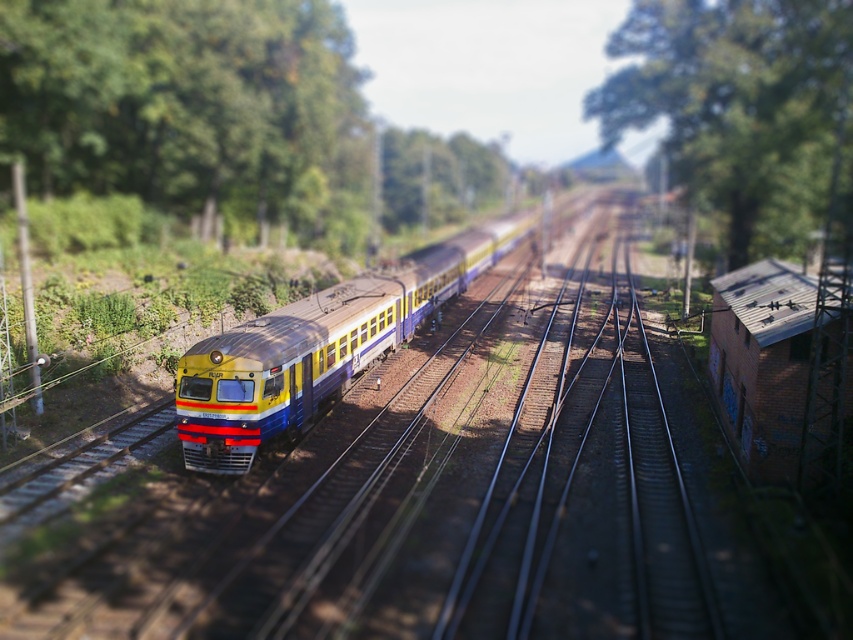
Question: Which is farther from the yellow matte train at center?

Choices:
 (A) green leafy tree at upper center
 (B) green leafy tree at upper left

Answer: (B)

Question: From the image, what is the correct spatial relationship of green leafy tree at upper left in relation to green leafy tree at upper center?

Choices:
 (A) above
 (B) below

Answer: (B)

Question: Which of these objects is positioned farthest from the yellow matte train at center?

Choices:
 (A) green leafy tree at upper center
 (B) green leafy tree at upper left

Answer: (B)

Question: Is green leafy tree at upper left positioned before green leafy tree at upper center?

Choices:
 (A) yes
 (B) no

Answer: (B)

Question: Is green leafy tree at upper left bigger than green leafy tree at upper center?

Choices:
 (A) yes
 (B) no

Answer: (B)

Question: Which object is closer to the camera taking this photo?

Choices:
 (A) green leafy tree at upper left
 (B) yellow matte train at center
 (C) green leafy tree at upper center

Answer: (B)